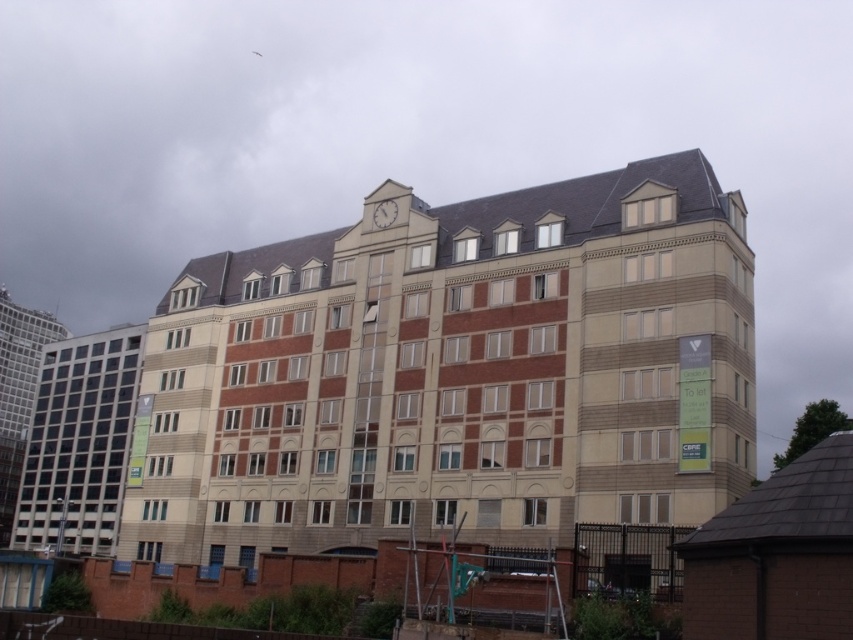
You are standing at a point 77.68 feet away from the point labeled as point (801, 570) on the building. If you want to take a photo of the building, would you need to zoom in or zoom out to capture the entire building in your camera frame?

Since you are 77.68 feet away from point (801, 570) on the building, you would need to zoom out to capture the entire building in your camera frame.

You are standing in front of the multi story building and want to take a photo of both the brown brick building at lower right and the matte glass building at left. Which building should you position yourself closer to in order to capture both in the same frame?

You should position yourself closer to the matte glass building at left because the brown brick building at lower right is to the right of it, allowing both to be included in the frame when centered on the matte glass building.

You are standing in front of the building and want to touch both the brown brick building at lower right and the white stone clock at upper center. Which one can you reach first without moving your position?

The brown brick building at lower right is closer to the viewer than the white stone clock at upper center, so you can reach it first without moving.